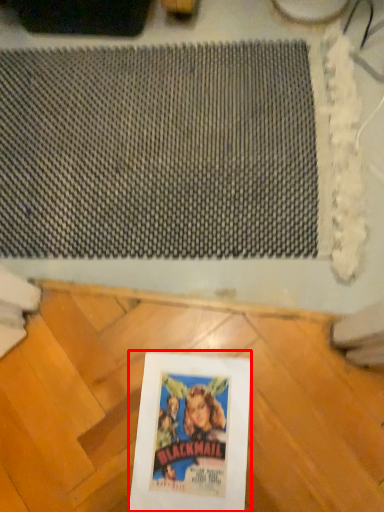
Question: From the image, what is the correct spatial relationship of picture frame (annotated by the red box) in relation to mat?

Choices:
 (A) right
 (B) left

Answer: (A)